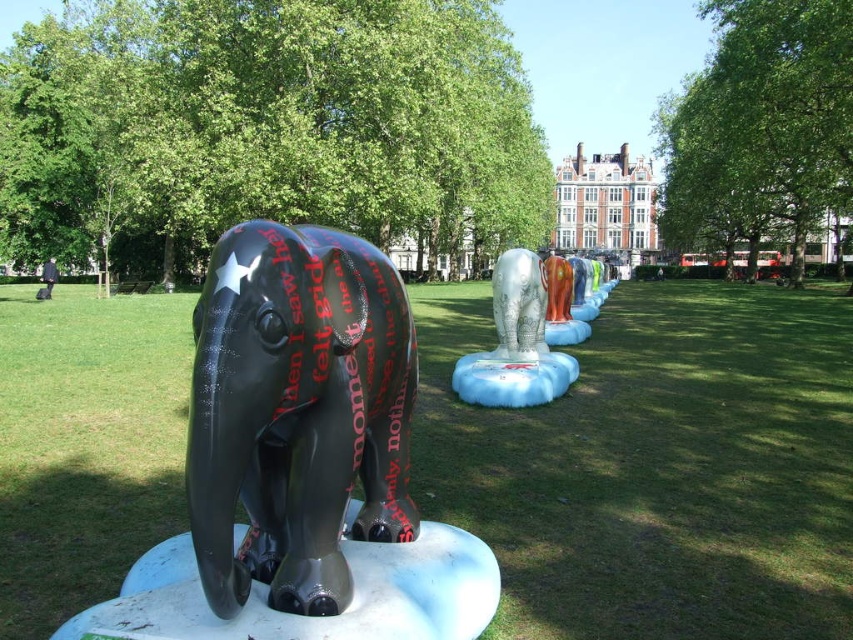
You are standing in the park and see the glossy black elephant at center and the shiny silver elephant at center. Which one is positioned lower in the arrangement?

The glossy black elephant at center is positioned lower than the shiny silver elephant at center.